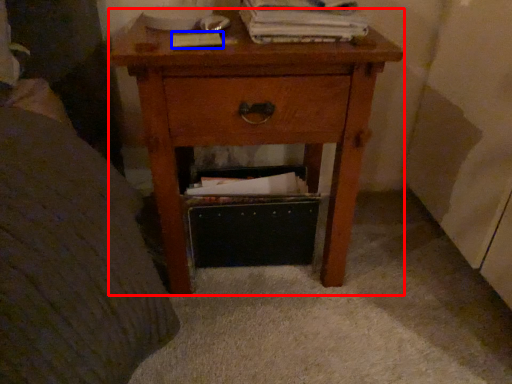
Question: Which object appears farthest to the camera in this image, nightstand (highlighted by a red box) or paperback book (highlighted by a blue box)?

Choices:
 (A) nightstand
 (B) paperback book

Answer: (B)